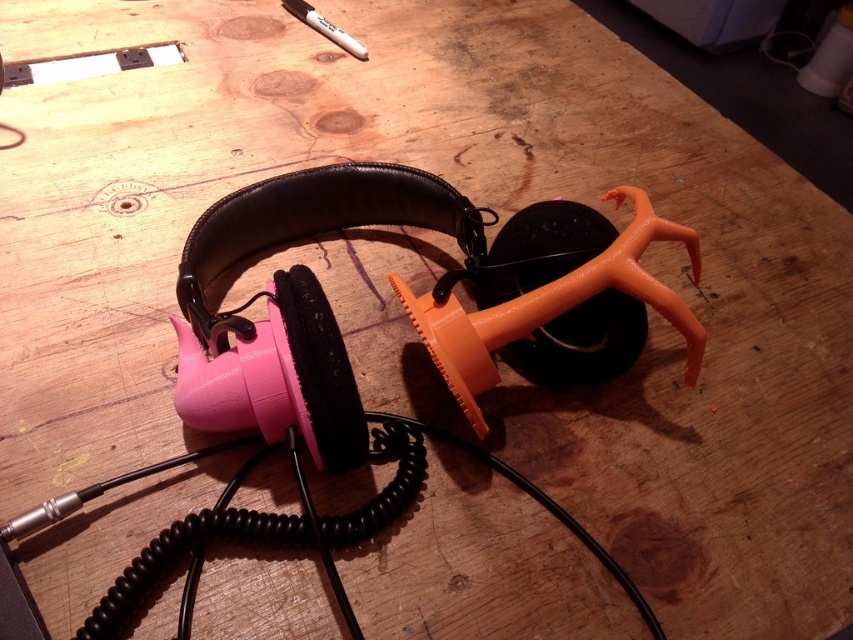
Does pink matte/soft earphone at center-left have a larger size compared to white matte marker at upper center?

Indeed, pink matte/soft earphone at center-left has a larger size compared to white matte marker at upper center.

Is point (302, 428) closer to viewer compared to point (317, 19)?

Yes, it is in front of point (317, 19).

I want to click on pink matte/soft earphone at center-left, so click(x=279, y=378).